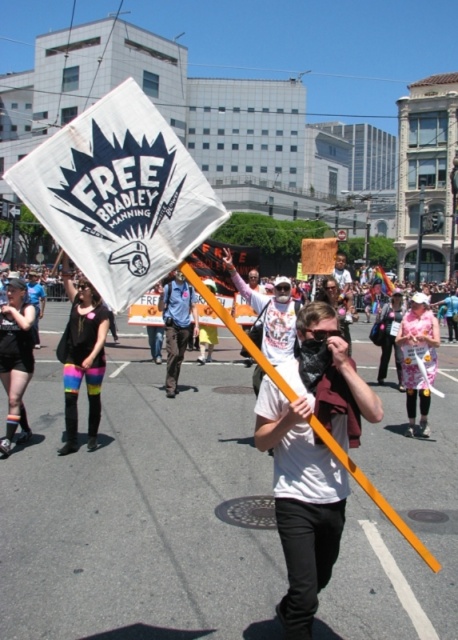
You are a photographer at the protest trying to capture a photo of both the pink floral dress at center and the blue uniform at center. Which one should you focus on first to ensure they are both in the frame?

The pink floral dress at center is positioned on the right side of blue uniform at center, so you should focus on the blue uniform at center first to ensure both are in the frame.